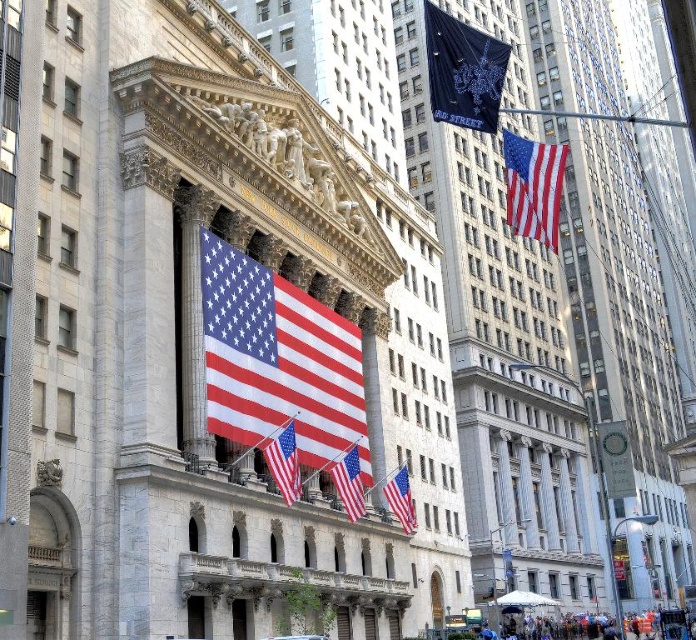
Question: Based on their relative distances, which object is nearer to the metallic silver car at center?

Choices:
 (A) red-white-blue fabric flag at upper right
 (B) matte white flag at center
 (C) black fabric banner at upper center
 (D) red fabric flag at center

Answer: (D)

Question: From the image, what is the correct spatial relationship of red-white-blue fabric flag at upper right in relation to red fabric flag at center?

Choices:
 (A) right
 (B) left

Answer: (A)

Question: Which object appears farthest from the camera in this image?

Choices:
 (A) red/white/blue fabric flag at center
 (B) matte white flag at center
 (C) red fabric flag at center

Answer: (B)

Question: Among these points, which one is nearest to the camera?

Choices:
 (A) (351, 499)
 (B) (290, 634)
 (C) (450, 45)
 (D) (509, 202)

Answer: (C)

Question: Does red-white-blue fabric flag at upper right have a larger size compared to matte white flag at center?

Choices:
 (A) yes
 (B) no

Answer: (A)

Question: Can you confirm if matte white flag at center is positioned above metallic silver car at center?

Choices:
 (A) no
 (B) yes

Answer: (B)